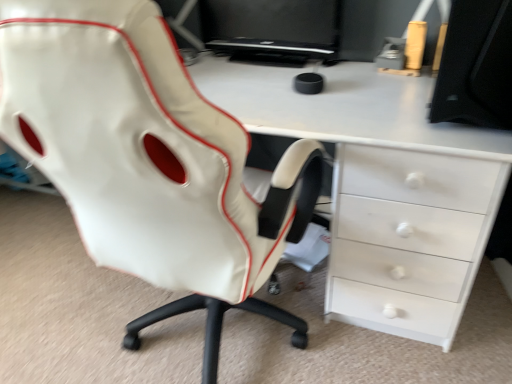
The image size is (512, 384). Find the location of `free space to the left of black matte monitor at upper right`. free space to the left of black matte monitor at upper right is located at coordinates (373, 104).